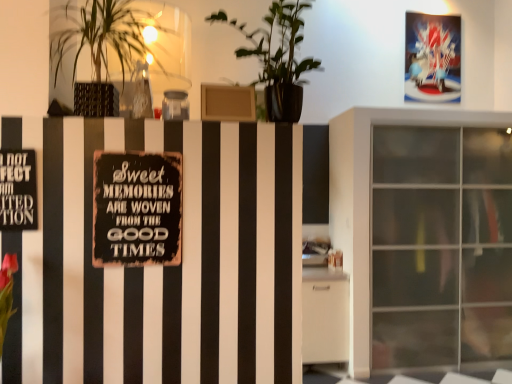
Question: Is rusty metal sign at center positioned in front of green leafy plant at upper left, which appears as the second houseplant when viewed from the right?

Choices:
 (A) yes
 (B) no

Answer: (B)

Question: Can we say rusty metal sign at center lies outside green leafy plant at upper left, which appears as the second houseplant when viewed from the right?

Choices:
 (A) no
 (B) yes

Answer: (B)

Question: Is the position of rusty metal sign at center more distant than that of green leafy plant at upper left, which is the first houseplant from left to right?

Choices:
 (A) yes
 (B) no

Answer: (A)

Question: Does rusty metal sign at center turn towards green leafy plant at upper left, which appears as the second houseplant when viewed from the right?

Choices:
 (A) yes
 (B) no

Answer: (B)

Question: Is green leafy plant at upper left, which appears as the second houseplant when viewed from the right, located within rusty metal sign at center?

Choices:
 (A) yes
 (B) no

Answer: (B)

Question: Considering the relative positions of rusty metal sign at center and green leafy plant at upper left, which appears as the second houseplant when viewed from the right, in the image provided, is rusty metal sign at center to the right of green leafy plant at upper left, which appears as the second houseplant when viewed from the right, from the viewer's perspective?

Choices:
 (A) yes
 (B) no

Answer: (A)

Question: Is rusty metal sign at center at the left side of shiny plastic postcard at upper right?

Choices:
 (A) yes
 (B) no

Answer: (A)

Question: From the image's perspective, is rusty metal sign at center on shiny plastic postcard at upper right?

Choices:
 (A) no
 (B) yes

Answer: (A)

Question: Is rusty metal sign at center surrounding shiny plastic postcard at upper right?

Choices:
 (A) no
 (B) yes

Answer: (A)

Question: Does rusty metal sign at center have a greater width compared to shiny plastic postcard at upper right?

Choices:
 (A) no
 (B) yes

Answer: (A)

Question: Does rusty metal sign at center touch shiny plastic postcard at upper right?

Choices:
 (A) no
 (B) yes

Answer: (A)

Question: From a real-world perspective, is rusty metal sign at center below shiny plastic postcard at upper right?

Choices:
 (A) yes
 (B) no

Answer: (A)

Question: From a real-world perspective, is green matte plant at upper center, the second houseplant viewed from the left, located higher than black metal sign at left?

Choices:
 (A) no
 (B) yes

Answer: (B)